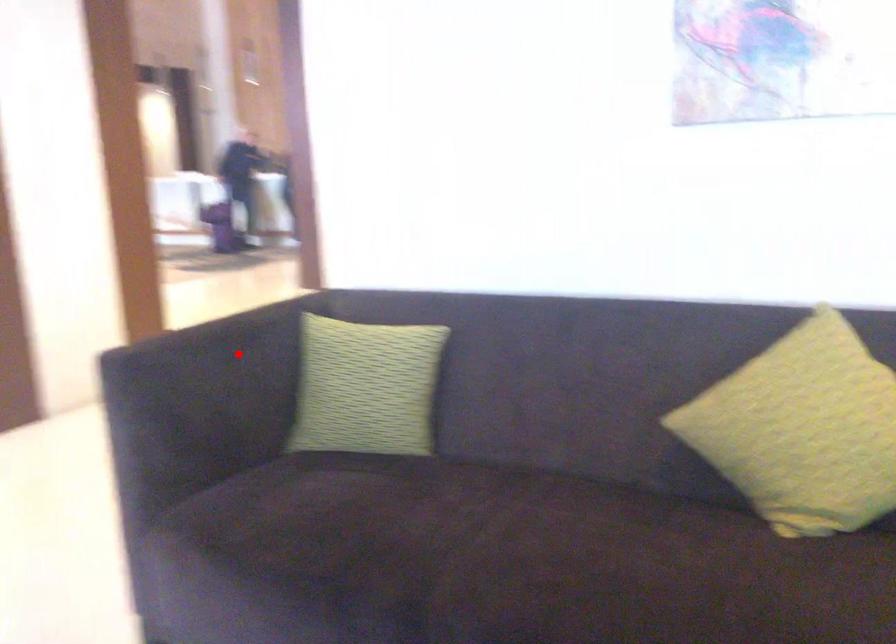
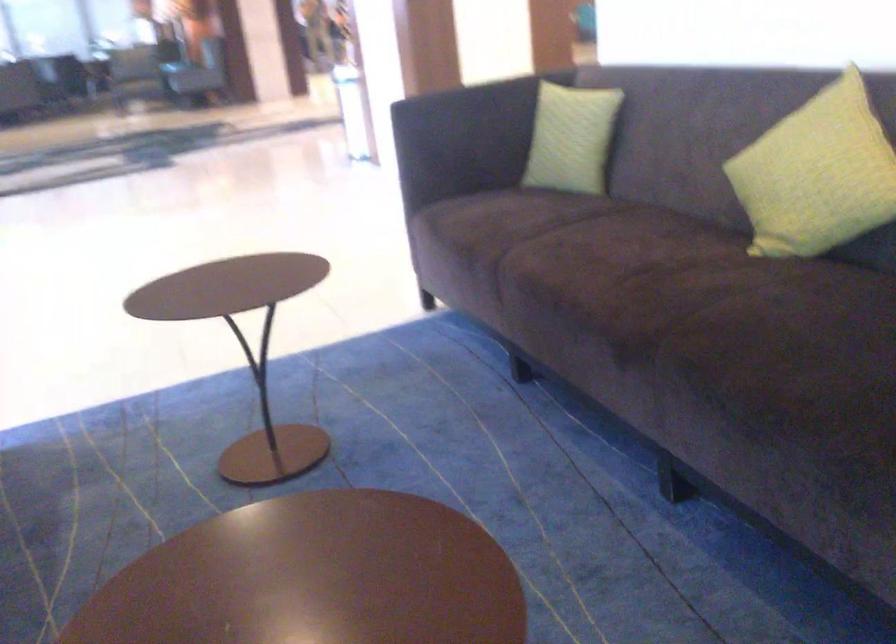
Question: I am providing you with two images of the same scene from different viewpoints. In image1, a red point is highlighted. Considering the same 3D point in image2, which of the following is correct?

Choices:
 (A) It is closer
 (B) It is farther

Answer: (B)